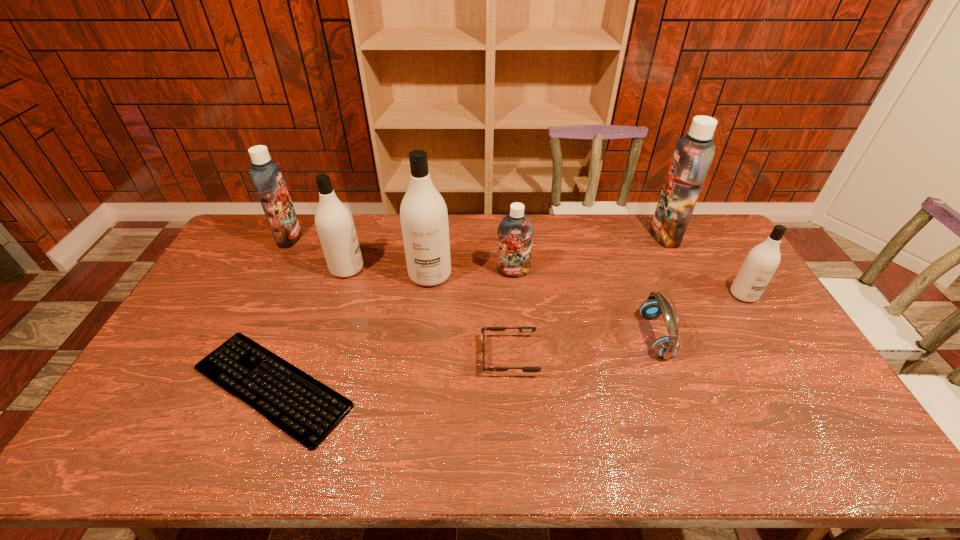
The width and height of the screenshot is (960, 540). I want to click on unoccupied position between the rightmost white shampoo and the second shampoo from right to left, so click(x=705, y=265).

Where is `object that stands as the fourth closest to the eighth object from left to right`? The width and height of the screenshot is (960, 540). object that stands as the fourth closest to the eighth object from left to right is located at coordinates (522, 329).

Locate which object is the third closest to the rightmost blue shampoo. Please provide its 2D coordinates. Your answer should be formatted as a tuple, i.e. [(x, y)], where the tuple contains the x and y coordinates of a point satisfying the conditions above.

[(515, 231)]

Locate an element on the screen. This screenshot has width=960, height=540. the third closest shampoo to the third shampoo from left to right is located at coordinates (266, 175).

Identify the location of the third closest shampoo to the leftmost blue shampoo. (515, 231).

The image size is (960, 540). Identify the location of blue shampoo that is the third closest one to the blue headset. (266, 175).

Choose which blue shampoo is the second nearest neighbor to the rightmost white shampoo. Please provide its 2D coordinates. Your answer should be formatted as a tuple, i.e. [(x, y)], where the tuple contains the x and y coordinates of a point satisfying the conditions above.

[(515, 231)]

Where is `white shampoo that is the second closest to the second blue shampoo from right to left`? Image resolution: width=960 pixels, height=540 pixels. white shampoo that is the second closest to the second blue shampoo from right to left is located at coordinates (334, 222).

You are a GUI agent. You are given a task and a screenshot of the screen. Output one action in this format:
    pyautogui.click(x=<x>, y=<y>)
    Task: Click on the white shampoo that is the second closest to the sunglasses
    This screenshot has width=960, height=540.
    Given the screenshot: What is the action you would take?
    pyautogui.click(x=334, y=222)